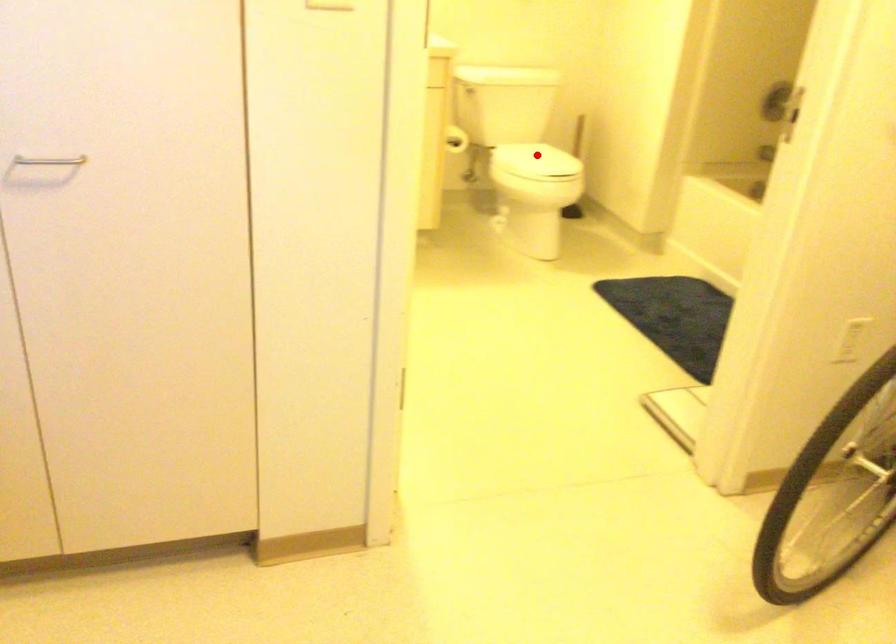
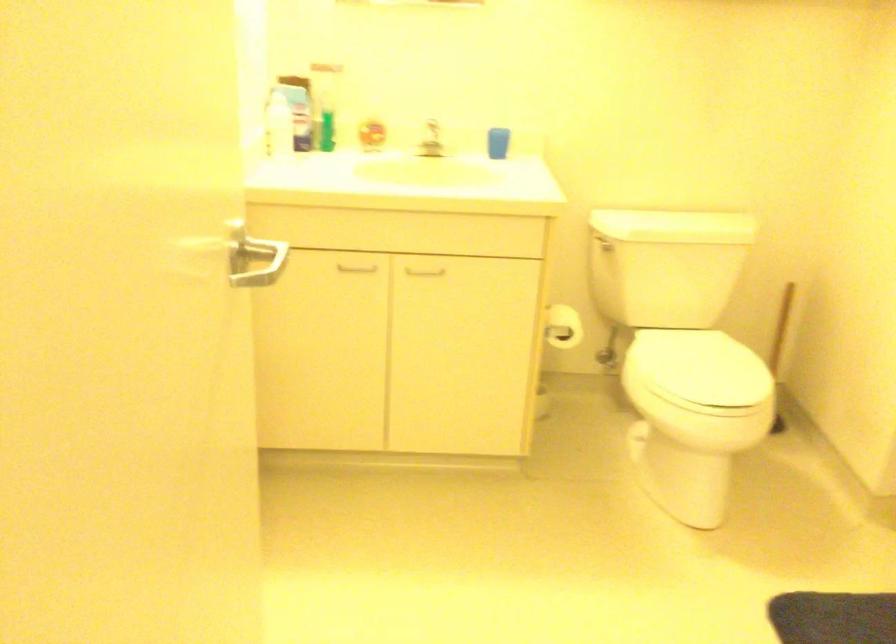
Question: I am providing you with two images of the same scene from different viewpoints. Given a red point in image1, look at the same physical point in image2. Is it:

Choices:
 (A) Closer to the viewpoint
 (B) Farther from the viewpoint

Answer: (A)